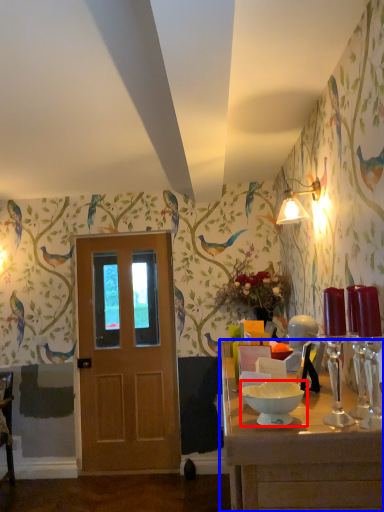
Question: Among these objects, which one is farthest to the camera, bowl (highlighted by a red box) or table (highlighted by a blue box)?

Choices:
 (A) bowl
 (B) table

Answer: (A)